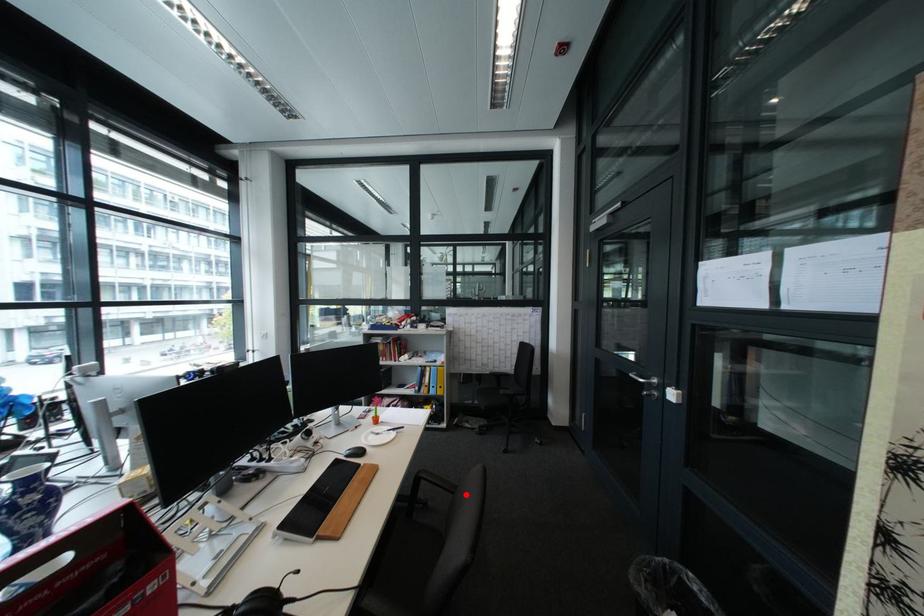
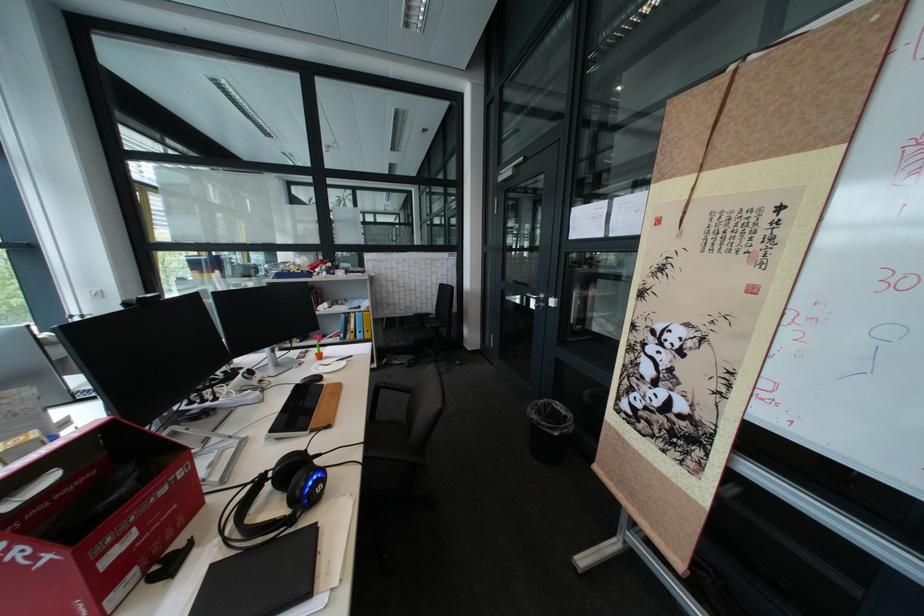
In the second image, find the point that corresponds to the highlighted location in the first image.

(423, 392)